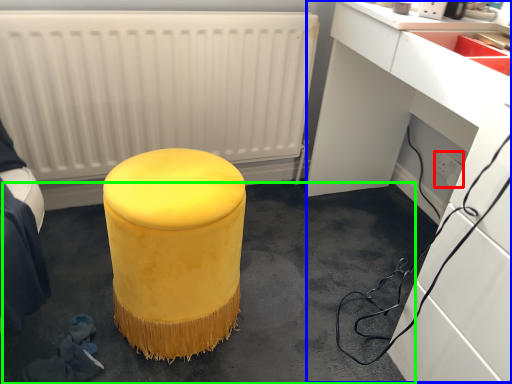
Question: Which is nearer to the electric outlet (highlighted by a red box)? computer desk (highlighted by a blue box) or concrete (highlighted by a green box).

Choices:
 (A) computer desk
 (B) concrete

Answer: (A)